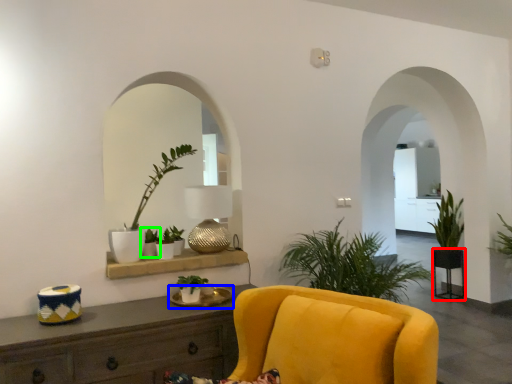
Question: Which object is the closest to the round table (highlighted by a red box)? Choose among these: round table (highlighted by a blue box) or houseplant (highlighted by a green box).

Choices:
 (A) round table
 (B) houseplant

Answer: (A)